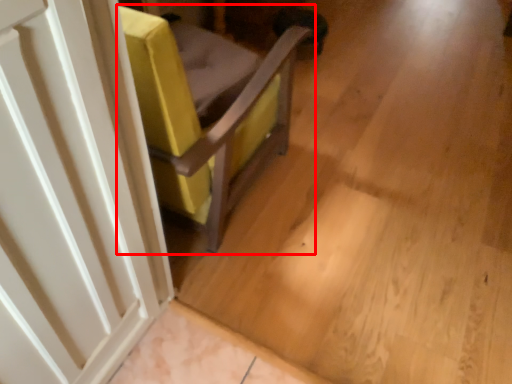
Question: Observing the image, what is the correct spatial positioning of furniture (annotated by the red box) in reference to door?

Choices:
 (A) right
 (B) left

Answer: (A)